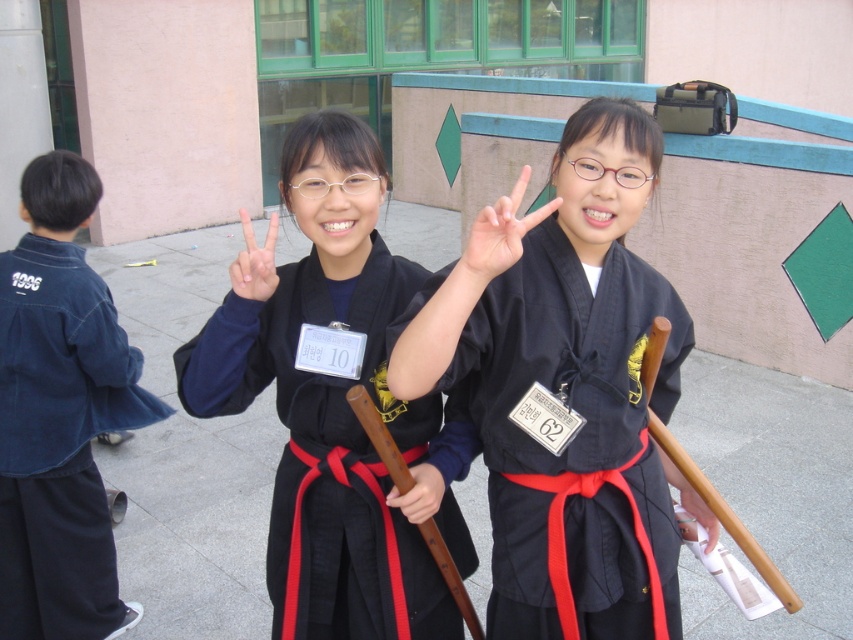
You are organizing a martial arts event and need to place a 1.5 meter tall banner between the denim jacket at left and the wooden stick at center. Can the banner fit vertically between them?

The denim jacket at left is taller than the wooden stick at center. Since the banner is 1.5 meters tall, we need to know the actual heights of both objects to determine if the banner can fit. However, the provided information only states that the denim jacket is taller than the wooden stick, but does not give specific measurements. Therefore, it is impossible to confirm if the banner will fit vertically between them based on the given details.

You are a photographer trying to capture both the matte black hand at center and the wooden stick at center in a single frame. Based on their sizes, which object should you focus on first to ensure both are in the frame?

The matte black hand at center is much taller than the wooden stick at center, so you should focus on the matte black hand at center first to ensure both fit in the frame.